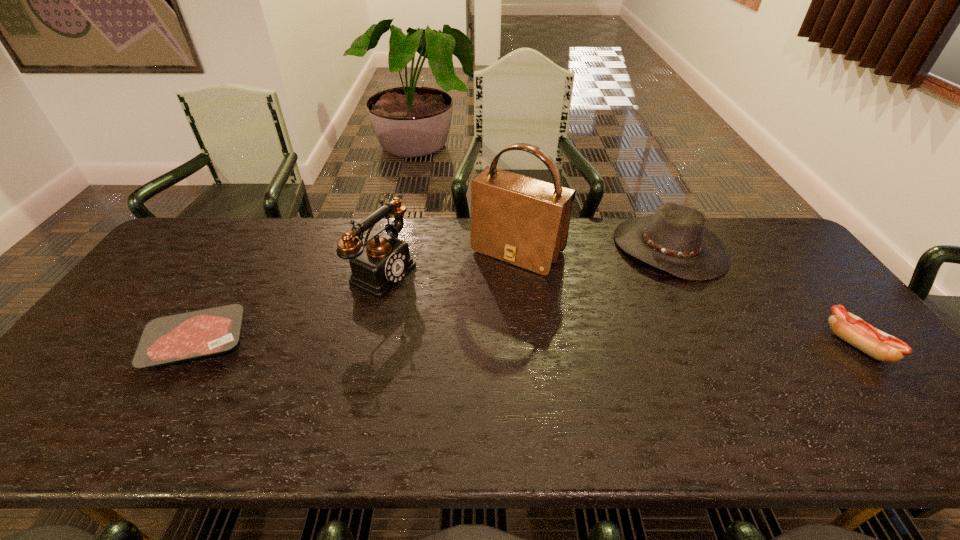
Image resolution: width=960 pixels, height=540 pixels. What are the coordinates of `the shortest object` in the screenshot? It's located at (175, 338).

Find the location of a particular element. This screenshot has width=960, height=540. the leftmost object is located at coordinates (175, 338).

What are the coordinates of `sausage` in the screenshot? It's located at (881, 346).

Locate an element on the screen. The height and width of the screenshot is (540, 960). the fourth tallest object is located at coordinates click(881, 346).

Image resolution: width=960 pixels, height=540 pixels. In order to click on shoulder bag in this screenshot , I will do `click(524, 221)`.

Identify the location of the third object from left to right. (524, 221).

At what (x,y) coordinates should I click in order to perform the action: click on hat. Please return your answer as a coordinate pair (x, y). Looking at the image, I should click on (675, 239).

Locate an element on the screen. The width and height of the screenshot is (960, 540). the fourth object from left to right is located at coordinates (675, 239).

The image size is (960, 540). Identify the location of the fourth shortest object. (384, 261).

Where is `telephone`? telephone is located at coordinates (384, 261).